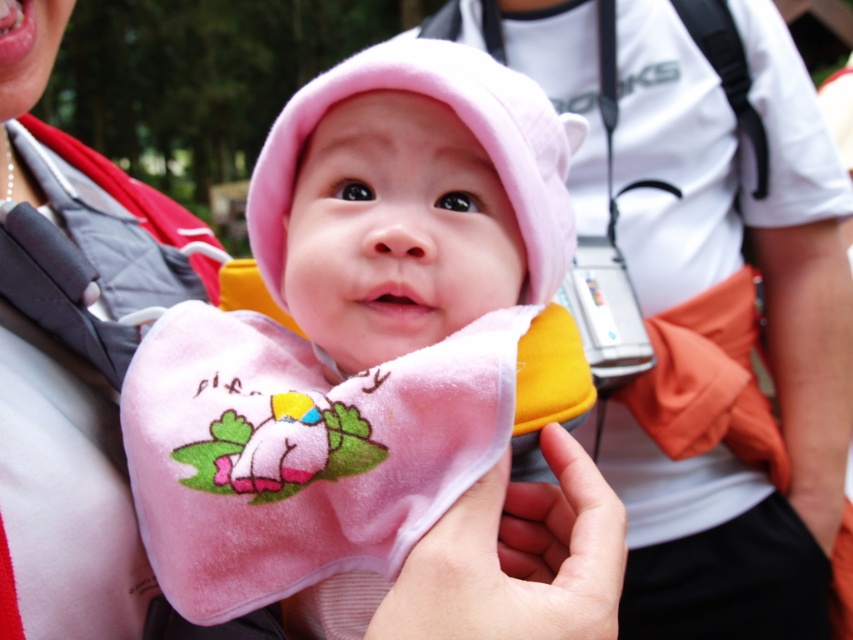
Question: Does pink soft fabric baby at center appear over velvet pink bib at center?

Choices:
 (A) no
 (B) yes

Answer: (A)

Question: Is pink soft fabric baby at center to the left of velvet pink bib at center from the viewer's perspective?

Choices:
 (A) yes
 (B) no

Answer: (B)

Question: Which point is closer to the camera taking this photo?

Choices:
 (A) (340, 516)
 (B) (86, 488)

Answer: (A)

Question: Does pink soft fabric baby at center appear under velvet pink bib at center?

Choices:
 (A) no
 (B) yes

Answer: (B)